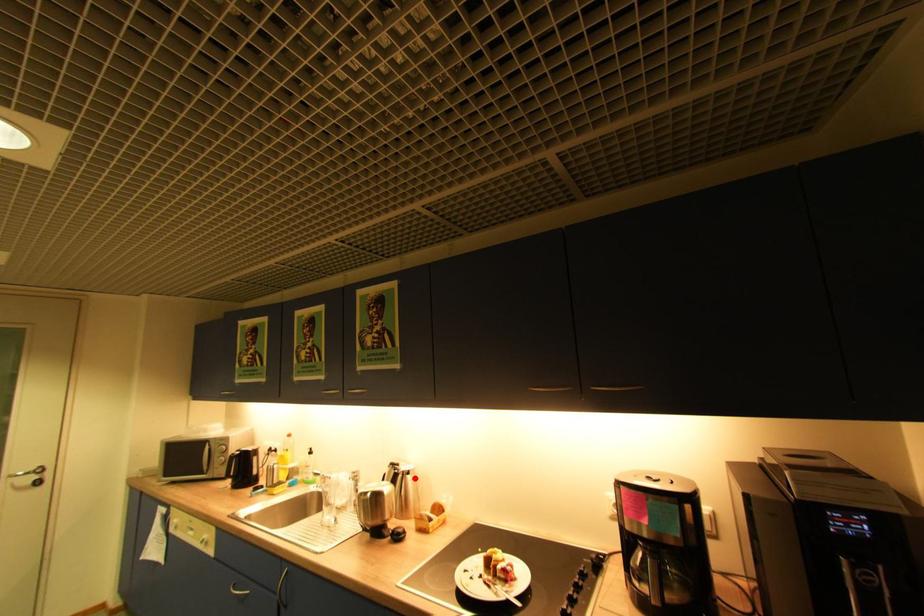
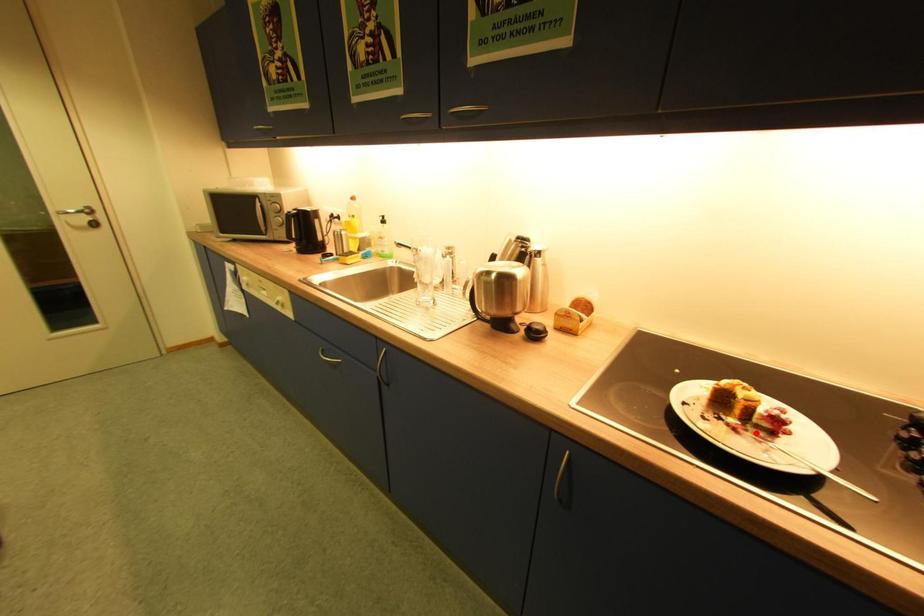
I am providing you with two images of the same scene from different viewpoints. A red point is marked on the first image and another point is marked on the second image. Does the point marked in image1 correspond to the same location as the one in image2?

No